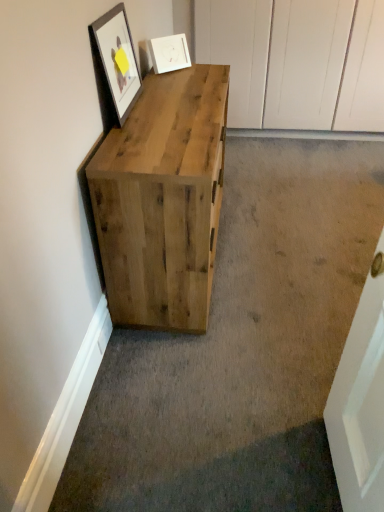
Where is `unoccupied region to the right of white matte picture frame at upper center, arranged as the second picture frame when viewed from the left`? The width and height of the screenshot is (384, 512). unoccupied region to the right of white matte picture frame at upper center, arranged as the second picture frame when viewed from the left is located at coordinates (203, 71).